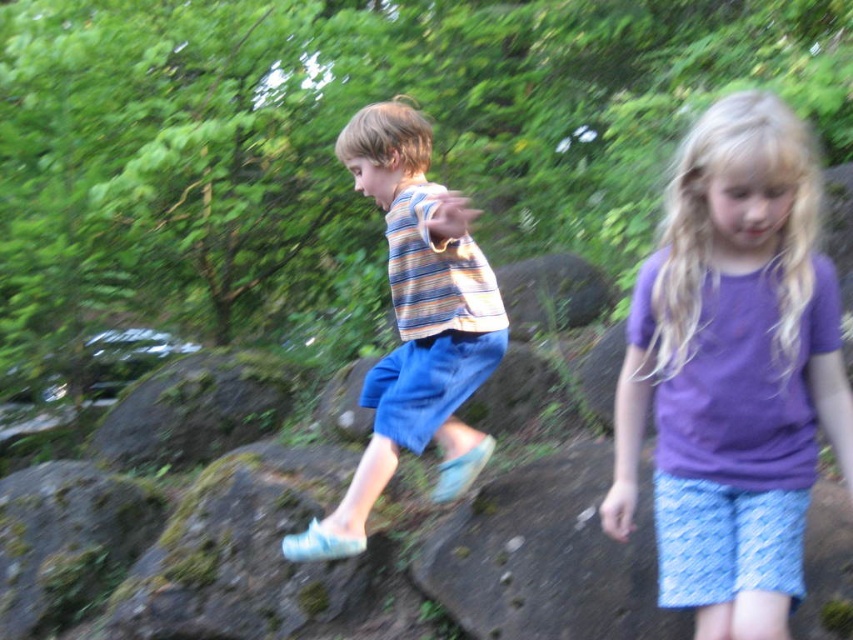
Question: Which object is farther from the camera taking this photo?

Choices:
 (A) purple cotton shirt at center
 (B) green mossy rock at center
 (C) striped cotton shirt at center

Answer: (B)

Question: Which of the following is the closest to the observer?

Choices:
 (A) (804, 385)
 (B) (442, 344)
 (C) (223, 433)
 (D) (10, 604)

Answer: (A)

Question: Which point is farther from the camera taking this photo?

Choices:
 (A) (386, 474)
 (B) (724, 161)
 (C) (3, 595)
 (D) (283, 400)

Answer: (D)

Question: Is green mossy rock at lower left closer to camera compared to green mossy rock at center?

Choices:
 (A) no
 (B) yes

Answer: (B)

Question: Does purple cotton shirt at center appear over striped cotton shirt at center?

Choices:
 (A) no
 (B) yes

Answer: (B)

Question: Does purple cotton shirt at center appear under striped cotton shirt at center?

Choices:
 (A) yes
 (B) no

Answer: (B)